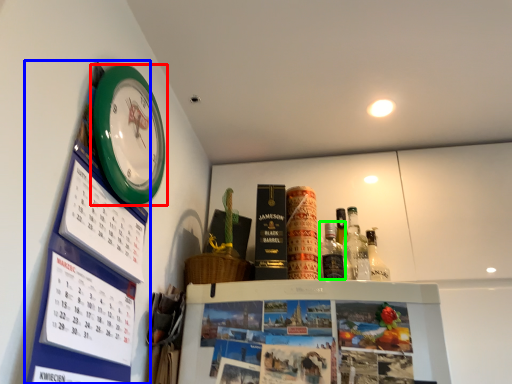
Question: Which object is positioned closest to wall clock (highlighted by a red box)? Select from bulletin board (highlighted by a blue box) and bottle (highlighted by a green box).

Choices:
 (A) bulletin board
 (B) bottle

Answer: (A)